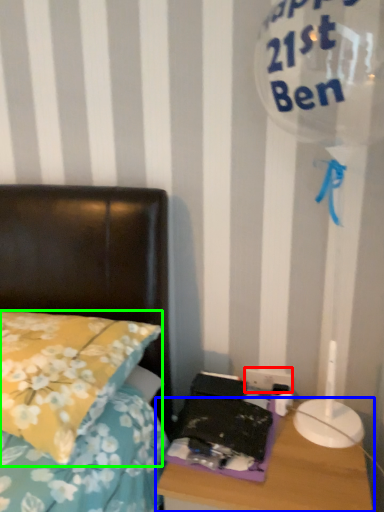
Question: Which is nearer to the electric outlet (highlighted by a red box)? nightstand (highlighted by a blue box) or pillow (highlighted by a green box).

Choices:
 (A) nightstand
 (B) pillow

Answer: (A)